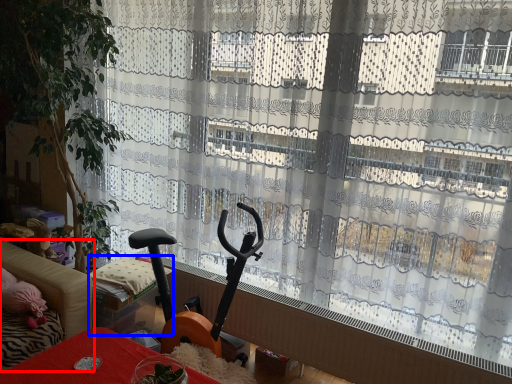
Question: Among these objects, which one is farthest to the camera, studio couch (highlighted by a red box) or furniture (highlighted by a blue box)?

Choices:
 (A) studio couch
 (B) furniture

Answer: (B)